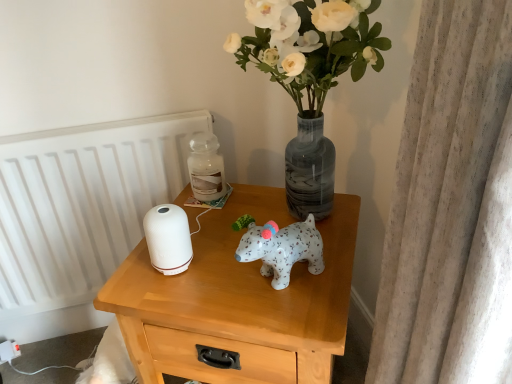
Find the location of a particular element. This screenshot has width=512, height=384. free space on the front side of translucent glass jar at upper center is located at coordinates (x=211, y=223).